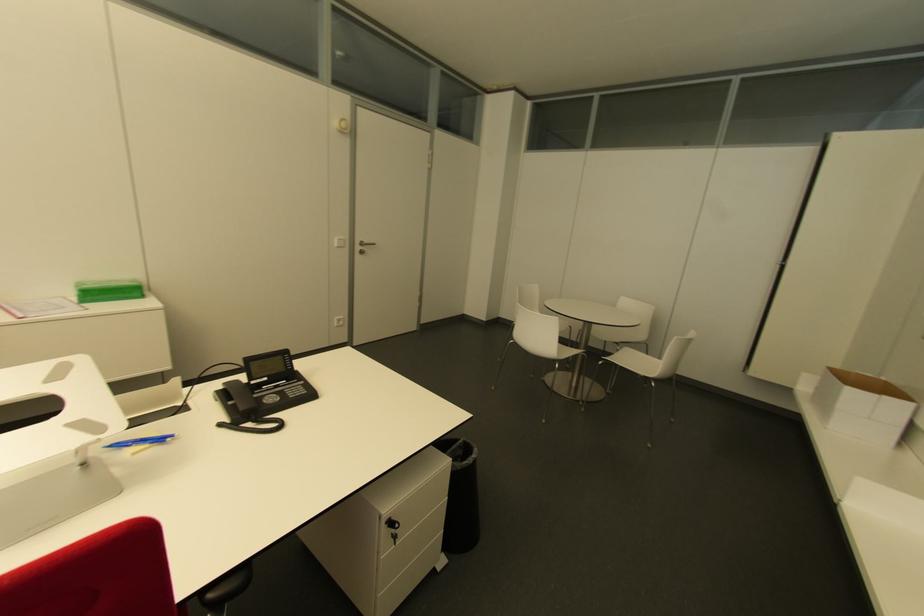
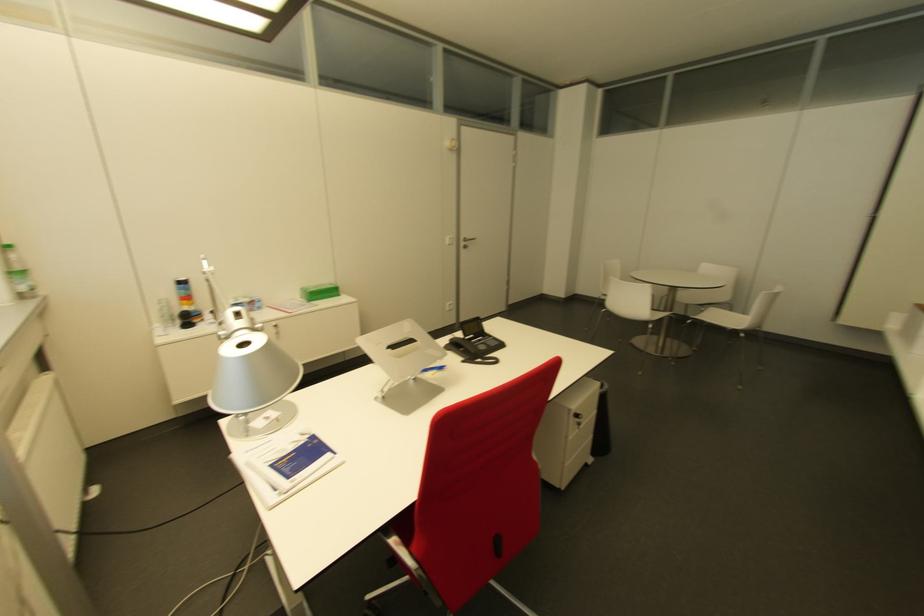
Question: I am providing you with two images of the same scene from different viewpoints. Which of the following objects are not visible in image2?

Choices:
 (A) black phone receiver
 (B) green plastic bottle
 (C) cabinet lock
 (D) none of these

Answer: (D)